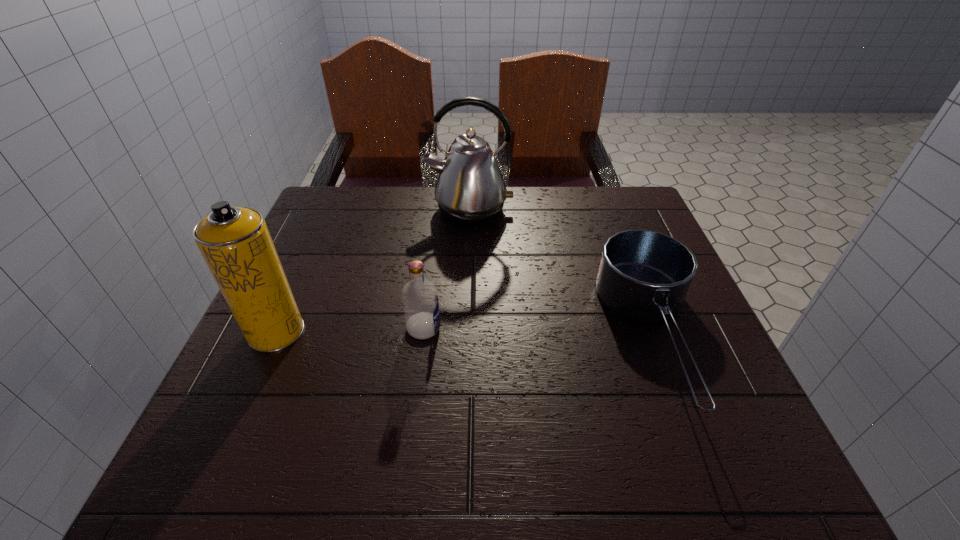
Locate an element on the screen. Image resolution: width=960 pixels, height=540 pixels. free space between the rightmost object and the kettle is located at coordinates (562, 273).

This screenshot has height=540, width=960. Identify the location of empty space that is in between the aerosol can and the kettle. (372, 271).

Find the location of `free space between the vodka and the leftmost object`. free space between the vodka and the leftmost object is located at coordinates (350, 330).

At what (x,y) coordinates should I click in order to perform the action: click on vacant region between the shortest object and the kettle. Please return your answer as a coordinate pair (x, y). The height and width of the screenshot is (540, 960). Looking at the image, I should click on (562, 273).

Locate an element on the screen. The width and height of the screenshot is (960, 540). free spot between the aerosol can and the saucepan is located at coordinates (466, 334).

At what (x,y) coordinates should I click in order to perform the action: click on vacant area that lies between the saucepan and the kettle. Please return your answer as a coordinate pair (x, y). Image resolution: width=960 pixels, height=540 pixels. Looking at the image, I should click on pos(562,273).

Locate an element on the screen. This screenshot has height=540, width=960. vacant area that lies between the second shortest object and the rightmost object is located at coordinates (539, 332).

Where is `free space between the aerosol can and the kettle`? Image resolution: width=960 pixels, height=540 pixels. free space between the aerosol can and the kettle is located at coordinates (372, 271).

You are a GUI agent. You are given a task and a screenshot of the screen. Output one action in this format:
    pyautogui.click(x=<x>, y=<y>)
    Task: Click on the object that can be found as the closest to the shortest object
    This screenshot has height=540, width=960.
    Given the screenshot: What is the action you would take?
    pyautogui.click(x=470, y=189)

Locate an element on the screen. Image resolution: width=960 pixels, height=540 pixels. the second closest object to the saucepan is located at coordinates (420, 301).